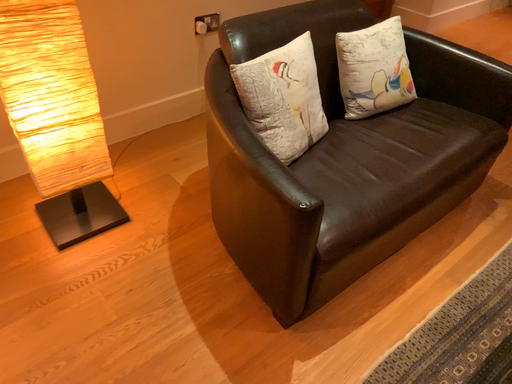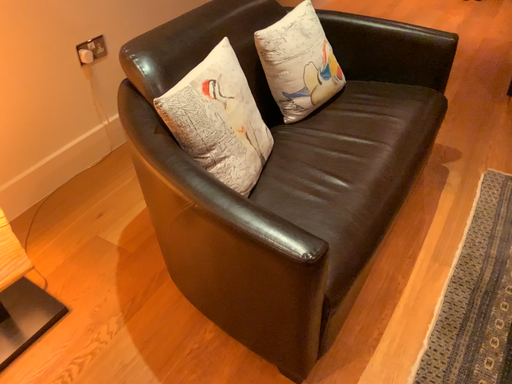
Question: How did the camera likely rotate when shooting the video?

Choices:
 (A) rotated left
 (B) rotated right

Answer: (B)